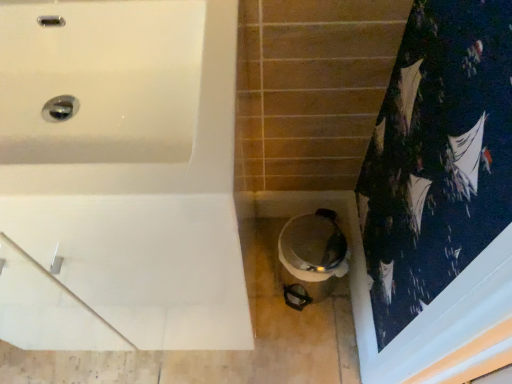
Question: Is point (310, 266) closer or farther from the camera than point (202, 311)?

Choices:
 (A) farther
 (B) closer

Answer: (A)

Question: From their relative heights in the image, would you say white glossy toilet at lower center is taller or shorter than white glossy bathtub at upper left?

Choices:
 (A) tall
 (B) short

Answer: (B)

Question: From a real-world perspective, is white glossy toilet at lower center physically located above or below white glossy bathtub at upper left?

Choices:
 (A) above
 (B) below

Answer: (B)

Question: Considering the positions of white glossy bathtub at upper left and white glossy toilet at lower center in the image, is white glossy bathtub at upper left taller or shorter than white glossy toilet at lower center?

Choices:
 (A) short
 (B) tall

Answer: (B)

Question: In the image, is white glossy bathtub at upper left on the left side or the right side of white glossy toilet at lower center?

Choices:
 (A) right
 (B) left

Answer: (B)

Question: Is white glossy bathtub at upper left bigger or smaller than white glossy toilet at lower center?

Choices:
 (A) small
 (B) big

Answer: (B)

Question: Choose the correct answer: Is white glossy bathtub at upper left inside white glossy toilet at lower center or outside it?

Choices:
 (A) inside
 (B) outside

Answer: (B)